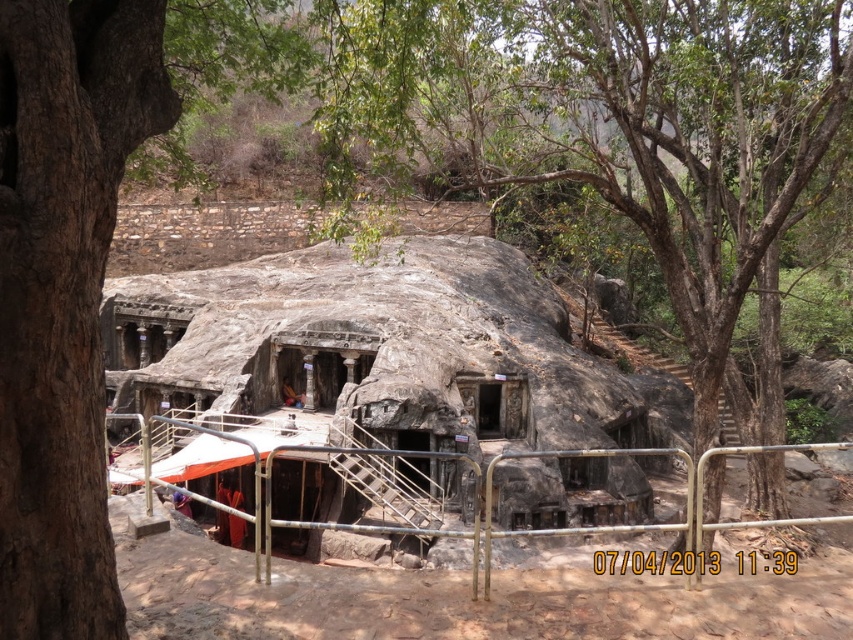
Question: Which object is farther from the camera taking this photo?

Choices:
 (A) brown rough tree trunk at left
 (B) natural stone cave at center
 (C) green leafy tree at center

Answer: (B)

Question: Based on their relative distances, which object is farther from the natural stone cave at center?

Choices:
 (A) brown rough tree trunk at left
 (B) green leafy tree at center

Answer: (A)

Question: Does natural stone cave at center lie in front of brown rough tree trunk at left?

Choices:
 (A) yes
 (B) no

Answer: (B)

Question: Can you confirm if natural stone cave at center is positioned to the right of brown rough tree trunk at left?

Choices:
 (A) yes
 (B) no

Answer: (A)

Question: Is green leafy tree at center to the right of brown rough tree trunk at left from the viewer's perspective?

Choices:
 (A) yes
 (B) no

Answer: (A)

Question: Which point is farther from the camera taking this photo?

Choices:
 (A) (438, 372)
 (B) (735, 234)
 (C) (102, 97)

Answer: (A)